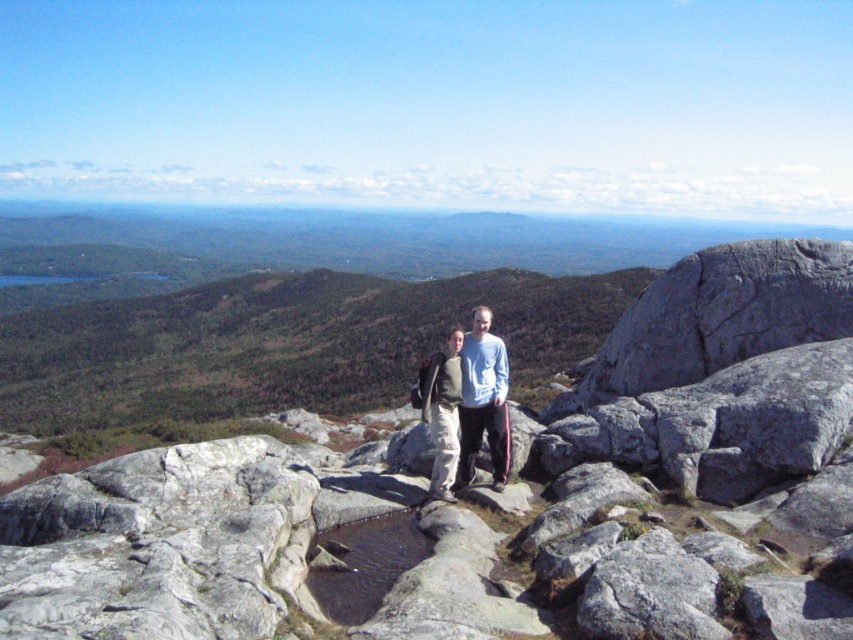
You are standing at the point marked by coordinates point (x=468, y=404). Looking around, you see the rugged gray rocks with some wet patches and two people dressed for hiking. Which direction should you walk to reach the nearest dry area?

The point 0.634, 0550 is on matte gray pants at center. Since the pants are part of a person standing on the rocks, the nearest dry area would likely be away from the wet patches. Observe the surrounding rocks and move towards areas without visible moisture.

You are a hiker who wants to check the weatherproofing of your clothing. You have both the matte gray pants at center and the gray fabric jacket at center. Which item is more likely to be protected from the wet rocks below?

The gray fabric jacket at center is more likely to be protected because it is positioned over the matte gray pants at center, which is under it and more exposed to the wet rocks.